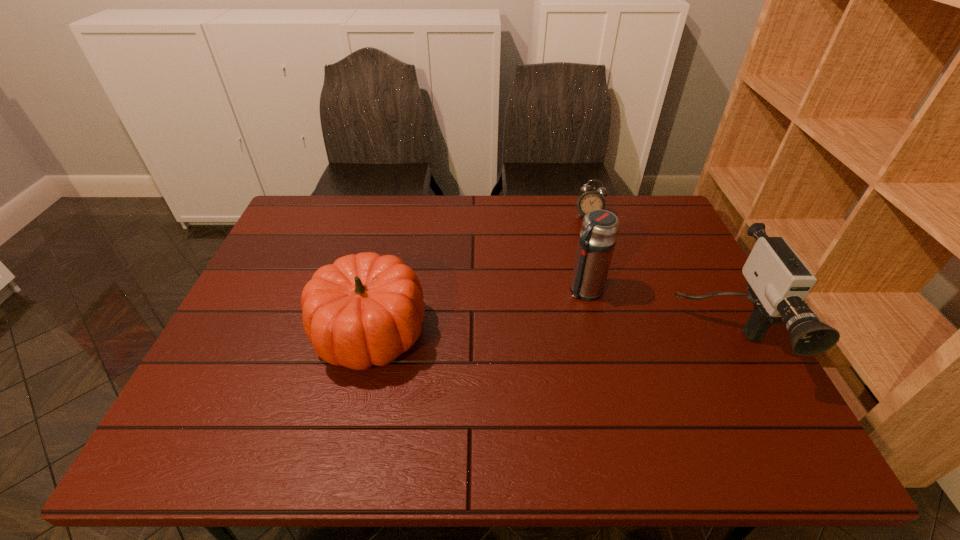
Locate an element on the screen. This screenshot has height=540, width=960. free space located on the face of the farthest object is located at coordinates 570,288.

Where is `free space located with a handle on the side of the thermos bottle`? free space located with a handle on the side of the thermos bottle is located at coordinates (496, 357).

This screenshot has width=960, height=540. I want to click on vacant region located 0.390m with a handle on the side of the thermos bottle, so click(x=465, y=382).

Find the location of a particular element. vacant space located with a handle on the side of the thermos bottle is located at coordinates (484, 367).

Where is `object at the far edge`? The height and width of the screenshot is (540, 960). object at the far edge is located at coordinates (591, 199).

Find the location of a particular element. This screenshot has width=960, height=540. pumpkin present at the near edge is located at coordinates tap(365, 309).

The height and width of the screenshot is (540, 960). I want to click on camcorder present at the near edge, so click(778, 281).

The width and height of the screenshot is (960, 540). Identify the location of object at the right edge. (778, 281).

At what (x,y) coordinates should I click in order to perform the action: click on object situated at the near right corner. Please return your answer as a coordinate pair (x, y). Looking at the image, I should click on (778, 281).

What are the coordinates of `vacant space at the far edge of the desktop` in the screenshot? It's located at (351, 224).